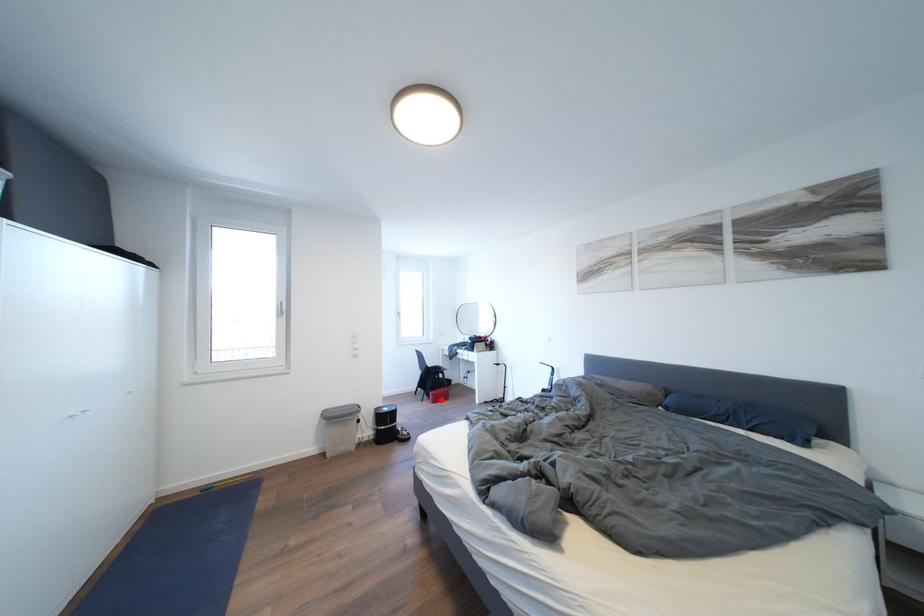
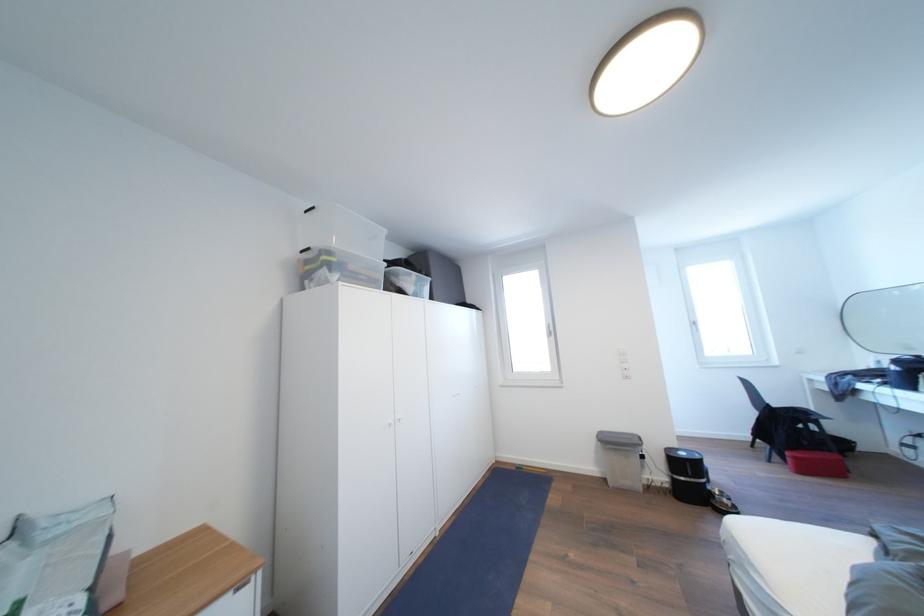
Question: I am providing you with two images of the same scene from different viewpoints. Image1 has a red point marked. In image2, the corresponding 3D location appears at what relative position? Reply with the corresponding letter.

Choices:
 (A) Closer
 (B) Farther

Answer: (A)